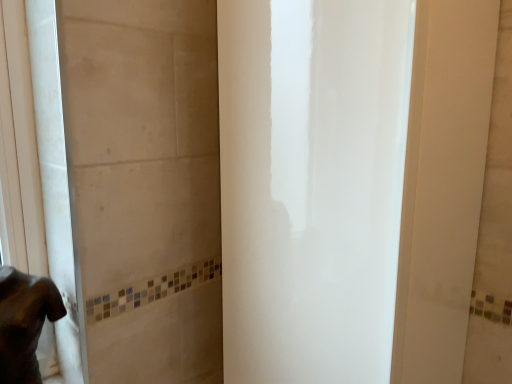
Question: Should I look upward or downward to see white glossy screen door at center?

Choices:
 (A) down
 (B) up

Answer: (A)

Question: Is dark brown fur at lower left facing away from white glossy screen door at center?

Choices:
 (A) yes
 (B) no

Answer: (B)

Question: Considering the relative sizes of dark brown fur at lower left and white glossy screen door at center in the image provided, is dark brown fur at lower left shorter than white glossy screen door at center?

Choices:
 (A) no
 (B) yes

Answer: (B)

Question: Is dark brown fur at lower left positioned beyond the bounds of white glossy screen door at center?

Choices:
 (A) yes
 (B) no

Answer: (A)

Question: From the image's perspective, is dark brown fur at lower left above white glossy screen door at center?

Choices:
 (A) yes
 (B) no

Answer: (B)

Question: Is dark brown fur at lower left bigger than white glossy screen door at center?

Choices:
 (A) no
 (B) yes

Answer: (A)

Question: Is dark brown fur at lower left taller than white glossy screen door at center?

Choices:
 (A) no
 (B) yes

Answer: (A)

Question: Is dark brown fur at lower left at the back of white glossy screen door at center?

Choices:
 (A) no
 (B) yes

Answer: (A)

Question: Is white glossy screen door at center next to dark brown fur at lower left?

Choices:
 (A) yes
 (B) no

Answer: (B)

Question: Considering the relative sizes of white glossy screen door at center and dark brown fur at lower left in the image provided, is white glossy screen door at center bigger than dark brown fur at lower left?

Choices:
 (A) no
 (B) yes

Answer: (B)

Question: From the image's perspective, is white glossy screen door at center over dark brown fur at lower left?

Choices:
 (A) no
 (B) yes

Answer: (B)

Question: From the image's perspective, would you say white glossy screen door at center is shown under dark brown fur at lower left?

Choices:
 (A) yes
 (B) no

Answer: (B)

Question: Does white glossy screen door at center have a lesser height compared to dark brown fur at lower left?

Choices:
 (A) yes
 (B) no

Answer: (B)

Question: Considering the positions of dark brown fur at lower left and white glossy screen door at center in the image, is dark brown fur at lower left taller or shorter than white glossy screen door at center?

Choices:
 (A) tall
 (B) short

Answer: (B)